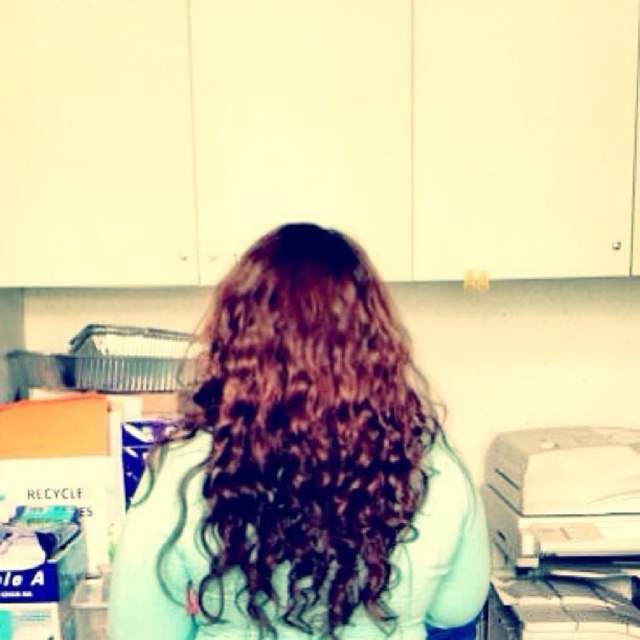
Question: Does dark brown curly hair at center have a greater width compared to white matte printer at lower right?

Choices:
 (A) yes
 (B) no

Answer: (A)

Question: Which of the following is the farthest from the observer?

Choices:
 (A) dark brown curly hair at center
 (B) white matte printer at lower right

Answer: (B)

Question: Does dark brown curly hair at center lie behind white matte printer at lower right?

Choices:
 (A) no
 (B) yes

Answer: (A)

Question: Among these objects, which one is farthest from the camera?

Choices:
 (A) dark brown curly hair at center
 (B) white matte printer at lower right

Answer: (B)

Question: Is dark brown curly hair at center wider than white matte printer at lower right?

Choices:
 (A) no
 (B) yes

Answer: (B)